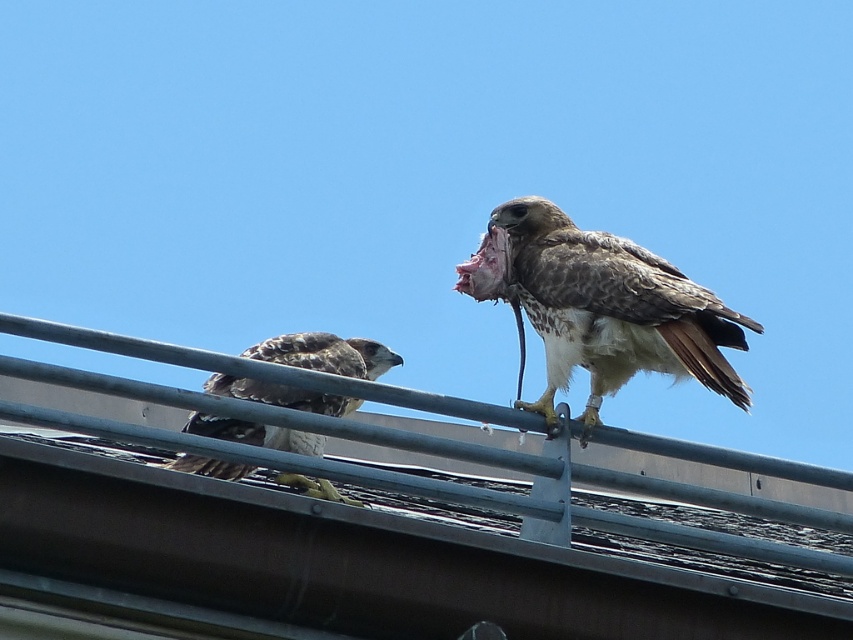
You are a birdwatcher trying to identify the hawk closest to you. You see two hawks with brown speckled feathers at upper right and brown speckled feathers at center. Which hawk has brown speckled feathers that are closer to you?

The brown speckled feathers at upper right are closer to the viewer than the brown speckled feathers at center, so the hawk with brown speckled feathers at upper right is closer to you.

You are a birdwatcher trying to photograph the brown speckled feathers at upper right. You notice the metallic gray roof at center might block your view. Based on their positions, will the roof block your view of the feathers?

The metallic gray roof at center is closer to the viewer than brown speckled feathers at upper right, so it will block the view of the brown speckled feathers at upper right.

You are a birdwatcher trying to identify the positions of two landmarks in the image. The landmarks are the metallic gray roof at center and the brown speckled feathers at upper right. According to the scene, which landmark is positioned to the left of the other?

The metallic gray roof at center is positioned to the left of the brown speckled feathers at upper right.